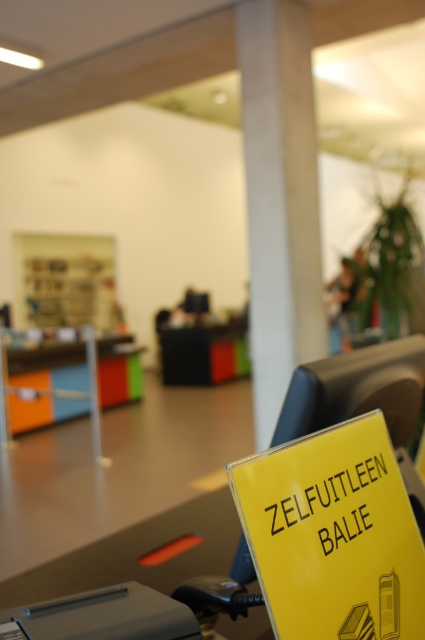
You are standing in the library and want to move from the yellow sign to the desk with the computer monitor. Which point, point (258, 285) or point (17, 417), is closer to your current position near the yellow sign?

Point (258, 285) is closer to the viewer than point (17, 417), so it is closer to your current position near the yellow sign.

You are a visitor in a library and you see the yellow paper sign at lower right and the wooden bookshelf at center. Which object is located to the right side of the other?

The yellow paper sign at lower right is positioned on the right side of wooden bookshelf at center.